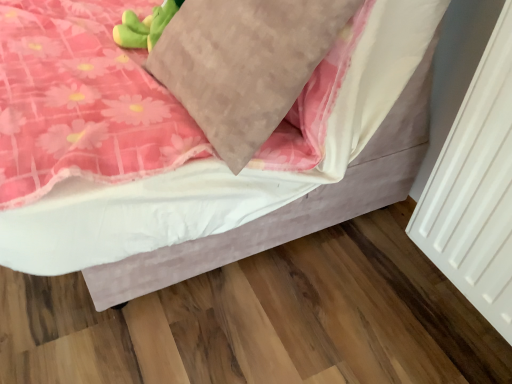
Question: Is velvet pink bed at center to the left or to the right of textured beige pillow at center in the image?

Choices:
 (A) left
 (B) right

Answer: (A)

Question: In terms of width, does velvet pink bed at center look wider or thinner when compared to textured beige pillow at center?

Choices:
 (A) wide
 (B) thin

Answer: (A)

Question: Does point [355, 110] appear closer or farther from the camera than point [236, 29]?

Choices:
 (A) closer
 (B) farther

Answer: (B)

Question: Looking at their shapes, would you say textured beige pillow at center is wider or thinner than velvet pink bed at center?

Choices:
 (A) thin
 (B) wide

Answer: (A)

Question: In the image, is textured beige pillow at center on the left side or the right side of velvet pink bed at center?

Choices:
 (A) left
 (B) right

Answer: (B)

Question: Considering the positions of textured beige pillow at center and velvet pink bed at center in the image, is textured beige pillow at center bigger or smaller than velvet pink bed at center?

Choices:
 (A) small
 (B) big

Answer: (A)

Question: From their relative heights in the image, would you say textured beige pillow at center is taller or shorter than velvet pink bed at center?

Choices:
 (A) short
 (B) tall

Answer: (A)